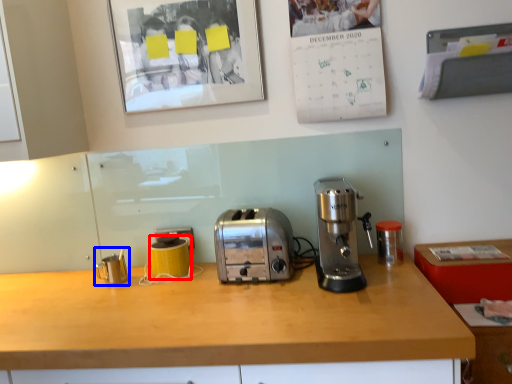
Question: Which point is further to the camera, appliance (highlighted by a red box) or appliance (highlighted by a blue box)?

Choices:
 (A) appliance
 (B) appliance

Answer: (A)